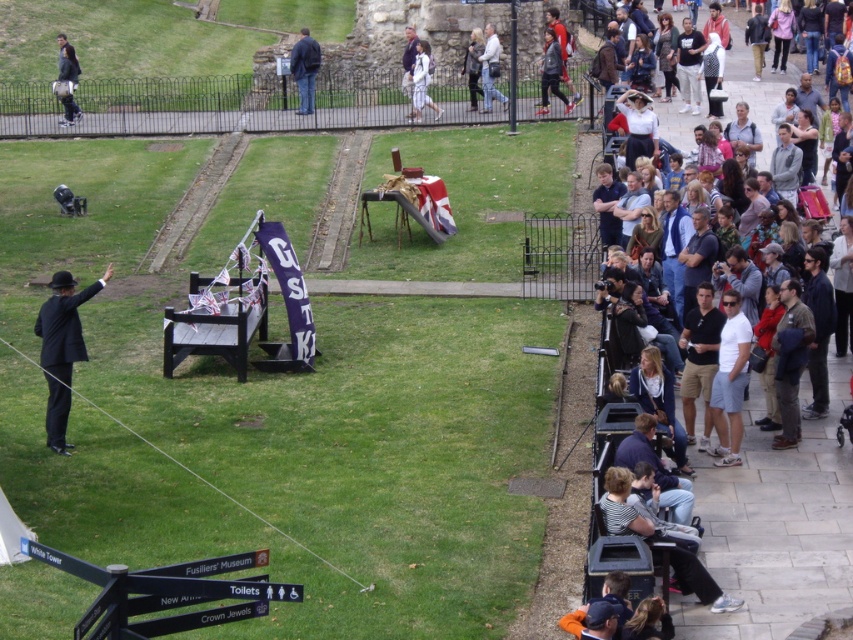
Between black matte suit at left and light blue jeans at center, which one has less height?

black matte suit at left

Is black matte suit at left bigger than light blue jeans at center?

Incorrect, black matte suit at left is not larger than light blue jeans at center.

Who is more distant from viewer, (65, 417) or (485, 45)?

The point (485, 45) is behind.

You are a GUI agent. You are given a task and a screenshot of the screen. Output one action in this format:
    pyautogui.click(x=<x>, y=<y>)
    Task: Click on the black matte suit at left
    This screenshot has width=853, height=640.
    Given the screenshot: What is the action you would take?
    pyautogui.click(x=62, y=348)

Who is taller, black matte suit at left or white cotton dress at center?

black matte suit at left is taller.

The image size is (853, 640). What do you see at coordinates (62, 348) in the screenshot? I see `black matte suit at left` at bounding box center [62, 348].

The width and height of the screenshot is (853, 640). Identify the location of black matte suit at left. (62, 348).

Is dark blue jeans at center wider than light brown leather jacket at upper right?

Yes, dark blue jeans at center is wider than light brown leather jacket at upper right.

Does dark blue jeans at center have a greater height compared to light brown leather jacket at upper right?

Yes.

Which is behind, point (299, 83) or point (740, 118)?

Positioned behind is point (299, 83).

Identify the location of dark blue jeans at center. The height and width of the screenshot is (640, 853). click(305, 68).